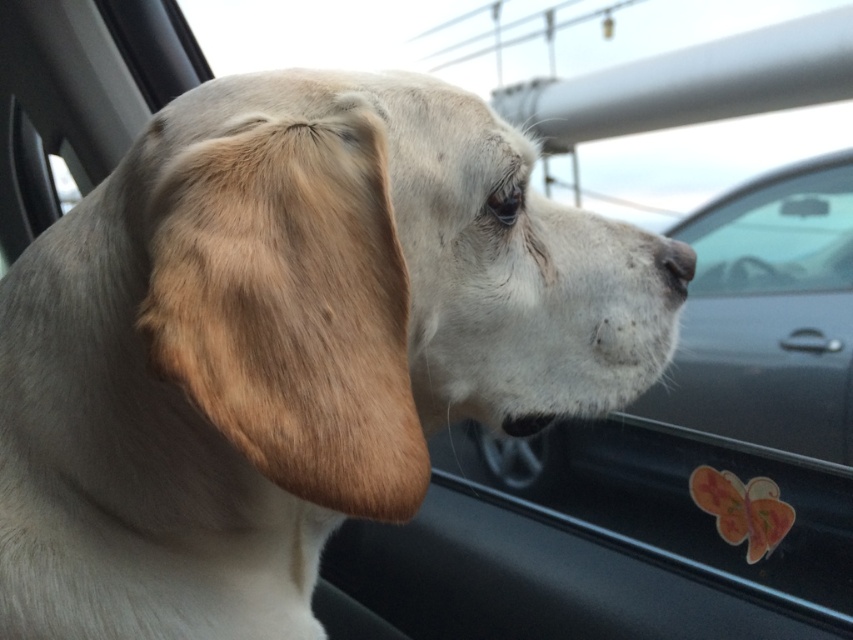
Based on the scene, can you determine if the light beige fur at center is wider than the white matte nose at center?

The light beige fur at center is wider than the white matte nose at center according to the description.

You are a dog owner checking your Beagle to ensure its comfort during a car ride. You notice the light beige fur at center and the white matte nose at center. Which of these two features is bigger in size?

The light beige fur at center is larger in size than the white matte nose at center.